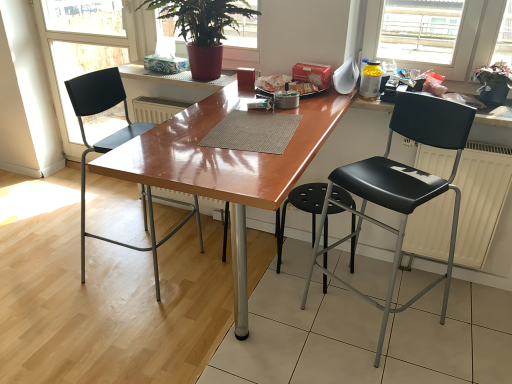
Question: From a real-world perspective, is matte black chair at left beneath yellow translucent bottle at upper right?

Choices:
 (A) no
 (B) yes

Answer: (B)

Question: Can you confirm if matte black chair at left is shorter than yellow translucent bottle at upper right?

Choices:
 (A) yes
 (B) no

Answer: (B)

Question: Does matte black chair at left have a greater width compared to yellow translucent bottle at upper right?

Choices:
 (A) yes
 (B) no

Answer: (A)

Question: Would you say matte black chair at left is a long distance from yellow translucent bottle at upper right?

Choices:
 (A) yes
 (B) no

Answer: (A)

Question: Does matte black chair at left come behind yellow translucent bottle at upper right?

Choices:
 (A) yes
 (B) no

Answer: (A)

Question: Considering the relative sizes of matte black chair at left and yellow translucent bottle at upper right in the image provided, is matte black chair at left taller than yellow translucent bottle at upper right?

Choices:
 (A) no
 (B) yes

Answer: (B)

Question: From a real-world perspective, is black plastic chair at left, the 1th chair when ordered from left to right, physically above matte black chair at left?

Choices:
 (A) yes
 (B) no

Answer: (B)

Question: Can you confirm if black plastic chair at left, the 1th chair when ordered from left to right, is positioned to the right of matte black chair at left?

Choices:
 (A) yes
 (B) no

Answer: (A)

Question: From the image's perspective, is black plastic chair at left, the 1th chair when ordered from left to right, beneath matte black chair at left?

Choices:
 (A) no
 (B) yes

Answer: (B)

Question: From the image's perspective, is black plastic chair at left, the 1th chair when ordered from left to right, on top of matte black chair at left?

Choices:
 (A) no
 (B) yes

Answer: (A)

Question: Is black plastic chair at left, which is counted as the second chair, starting from the right, wider than matte black chair at left?

Choices:
 (A) no
 (B) yes

Answer: (B)

Question: Would you say matte black chair at left is part of black plastic chair at left, the 1th chair when ordered from left to right,'s contents?

Choices:
 (A) yes
 (B) no

Answer: (B)

Question: Does green leafy plant at upper right, which is the 2th houseplant in left-to-right order, have a larger size compared to white matte radiator at right?

Choices:
 (A) yes
 (B) no

Answer: (B)